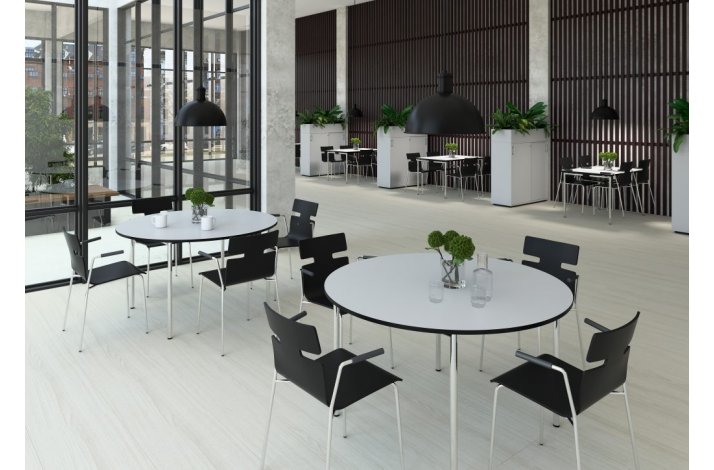
At what (x,y) coordinates should I click in order to perform the action: click on black hanging light fixtures over tables. Please return your answer as a coordinate pair (x, y). Looking at the image, I should click on (201, 117), (446, 113), (608, 110), (353, 110).